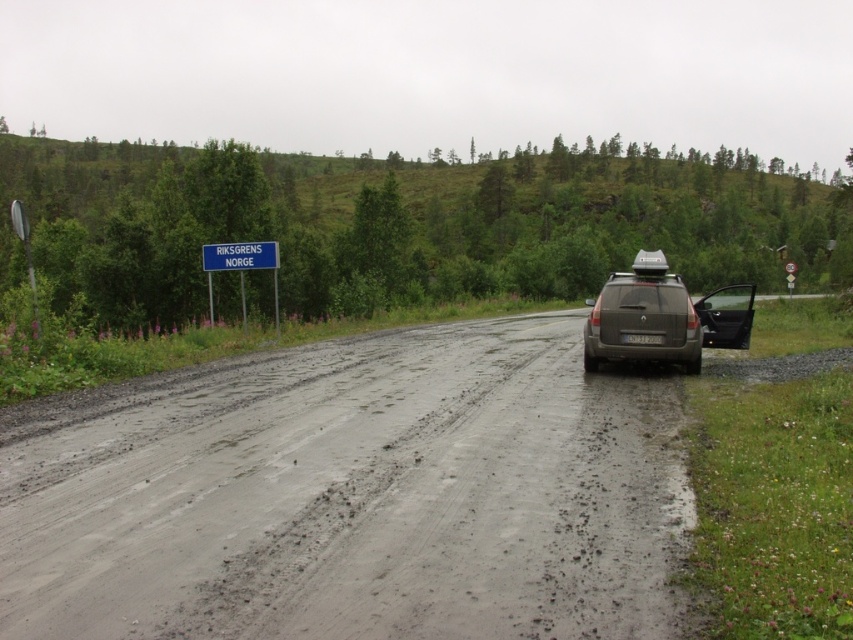
Question: Is wet asphalt road at center smaller than white plastic license plate at center?

Choices:
 (A) no
 (B) yes

Answer: (A)

Question: Which object is positioned farthest from the white plastic license plate at center?

Choices:
 (A) blue plastic sign at upper center
 (B) wet asphalt road at center
 (C) satin silver suv at right
 (D) blue metallic sign at left

Answer: (D)

Question: Can you confirm if wet asphalt road at center is positioned to the right of blue plastic sign at upper center?

Choices:
 (A) yes
 (B) no

Answer: (A)

Question: Which of the following is the closest to the observer?

Choices:
 (A) (641, 336)
 (B) (273, 248)
 (C) (614, 400)
 (D) (259, 262)

Answer: (C)

Question: Which of the following is the closest to the observer?

Choices:
 (A) satin silver suv at right
 (B) blue metallic sign at left
 (C) white plastic license plate at center

Answer: (A)

Question: Does wet asphalt road at center have a lesser width compared to blue metallic sign at left?

Choices:
 (A) yes
 (B) no

Answer: (B)